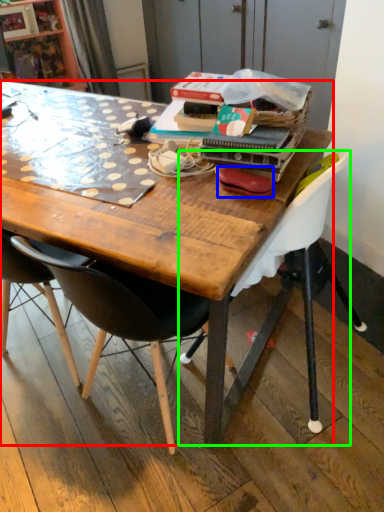
Question: Considering the real-world distances, which object is closest to desk (highlighted by a red box)? handbag (highlighted by a blue box) or chair (highlighted by a green box).

Choices:
 (A) handbag
 (B) chair

Answer: (B)